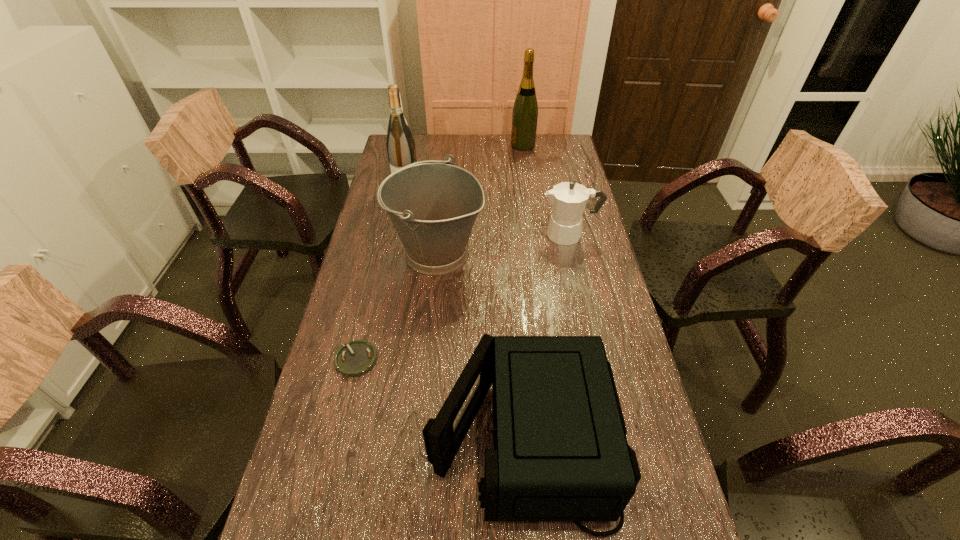
Where is `object that is at the far edge`? The image size is (960, 540). object that is at the far edge is located at coordinates (525, 109).

At what (x,y) coordinates should I click in order to perform the action: click on wine bottle positioned at the left edge. Please return your answer as a coordinate pair (x, y). The height and width of the screenshot is (540, 960). Looking at the image, I should click on (400, 144).

Identify the location of bucket located in the left edge section of the desktop. (433, 204).

Where is `ashtray at the left edge`? The image size is (960, 540). ashtray at the left edge is located at coordinates [354, 359].

Identify the location of wine bottle that is positioned at the right edge. This screenshot has width=960, height=540. (525, 109).

You are a GUI agent. You are given a task and a screenshot of the screen. Output one action in this format:
    pyautogui.click(x=<x>, y=<y>)
    Task: Click on the coffeepot at the right edge
    
    Given the screenshot: What is the action you would take?
    pyautogui.click(x=568, y=199)

This screenshot has width=960, height=540. What are the coordinates of `microwave oven that is at the right edge` in the screenshot? It's located at (560, 454).

Locate an element on the screen. The height and width of the screenshot is (540, 960). object at the far right corner is located at coordinates (525, 109).

In the image, there is a desktop. In order to click on free region at the far edge in this screenshot , I will do `click(492, 146)`.

Identify the location of free space at the left edge of the desktop. click(374, 208).